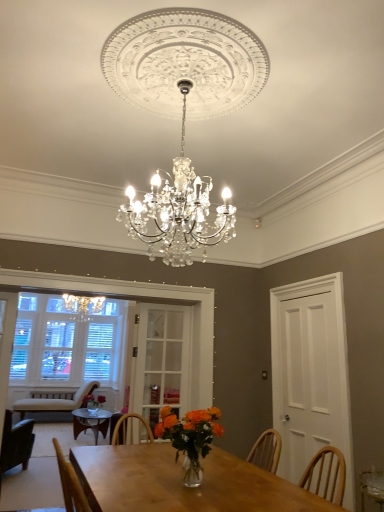
Question: Is white wood door at right, placed as the 1th glass door when sorted from right to left, positioned with its back to clear glass door at center, which appears as the first glass door when viewed from the left?

Choices:
 (A) yes
 (B) no

Answer: (B)

Question: Is white wood door at right, positioned as the second glass door in left-to-right order, surrounding clear glass door at center, which appears as the first glass door when viewed from the left?

Choices:
 (A) yes
 (B) no

Answer: (B)

Question: Can you confirm if white wood door at right, placed as the 1th glass door when sorted from right to left, is positioned to the left of clear glass door at center, which appears as the first glass door when viewed from the left?

Choices:
 (A) yes
 (B) no

Answer: (B)

Question: Can you confirm if white wood door at right, positioned as the second glass door in left-to-right order, is thinner than clear glass door at center, which appears as the 2th glass door when viewed from the right?

Choices:
 (A) no
 (B) yes

Answer: (A)

Question: Are white wood door at right, positioned as the second glass door in left-to-right order, and clear glass door at center, which appears as the first glass door when viewed from the left, beside each other?

Choices:
 (A) no
 (B) yes

Answer: (A)

Question: Visually, is beige fabric chair at left, acting as the 2th chair starting from the front, positioned to the left or to the right of white wood door at right, placed as the 1th glass door when sorted from right to left?

Choices:
 (A) left
 (B) right

Answer: (A)

Question: Is beige fabric chair at left, which is the first chair in bottom-to-top order, inside the boundaries of white wood door at right, positioned as the second glass door in left-to-right order, or outside?

Choices:
 (A) outside
 (B) inside

Answer: (A)

Question: From a real-world perspective, is beige fabric chair at left, acting as the 2th chair starting from the front, physically located above or below white wood door at right, placed as the 1th glass door when sorted from right to left?

Choices:
 (A) above
 (B) below

Answer: (B)

Question: From the image's perspective, is beige fabric chair at left, acting as the 2th chair starting from the front, positioned above or below white wood door at right, positioned as the second glass door in left-to-right order?

Choices:
 (A) above
 (B) below

Answer: (B)

Question: Relative to beige fabric chair at left, which is the first chair in bottom-to-top order, is white wood door at right, positioned as the second glass door in left-to-right order, in front or behind?

Choices:
 (A) front
 (B) behind

Answer: (A)

Question: From the image's perspective, is white wood door at right, placed as the 1th glass door when sorted from right to left, located above or below beige fabric chair at left, acting as the 2th chair starting from the front?

Choices:
 (A) below
 (B) above

Answer: (B)

Question: Is point (299, 479) positioned closer to the camera than point (97, 387)?

Choices:
 (A) closer
 (B) farther

Answer: (A)

Question: From a real-world perspective, is white wood door at right, placed as the 1th glass door when sorted from right to left, positioned above or below beige fabric chair at left, which is counted as the second chair, starting from the top?

Choices:
 (A) below
 (B) above

Answer: (B)

Question: In the image, is dark green fabric chair at left, which appears as the first chair when viewed from the front, on the left side or the right side of white wood door at right, placed as the 1th glass door when sorted from right to left?

Choices:
 (A) left
 (B) right

Answer: (A)

Question: Is point (11, 446) positioned closer to the camera than point (326, 294)?

Choices:
 (A) farther
 (B) closer

Answer: (A)